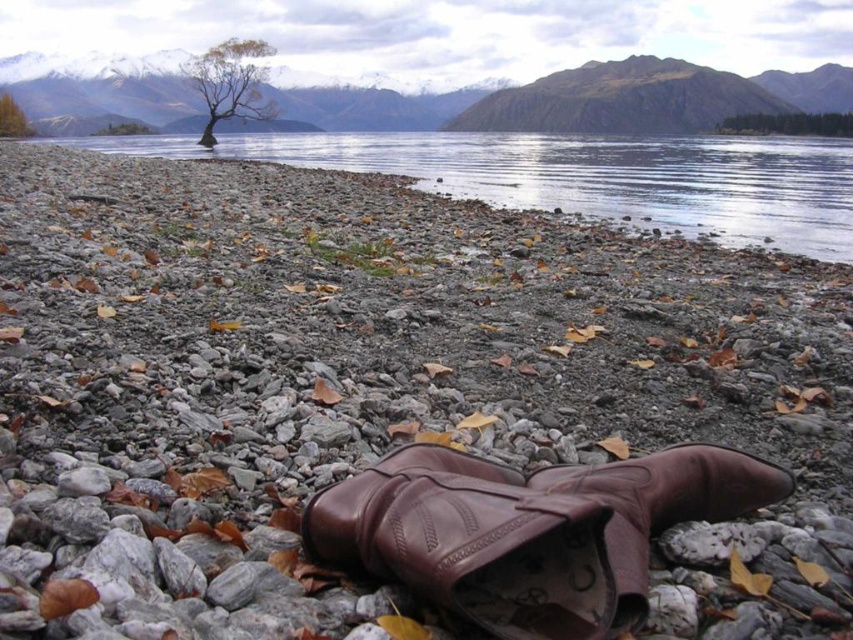
You are standing at the shore and want to step into the clear water at shore center. Based on the coordinates provided, where exactly should you step to avoid the pebbles and autumn leaves?

You should step at point [585,176] where the clear water at shore center is located to avoid the pebbles and autumn leaves.

You are planning to walk from the clear water at shore center to the green leafy tree at center. If your average walking speed is 3 feet per second, how many seconds will it take you to reach the tree?

The distance between clear water at shore center and green leafy tree at center is 91.48 feet. At a speed of 3 feet per second, dividing 91.48 by 3 gives approximately 30.5 seconds. Therefore, it will take roughly 30.5 seconds to reach the tree.

You are standing at the lakeside and want to take a photo of the brown leafy tree at upper center without the clear water at shore center in the foreground. Is this possible?

The clear water at shore center is in front of the brown leafy tree at upper center, so it will block the view. To avoid the water in the foreground, you would need to position yourself so that the tree is framed behind the water or find an angle where the water is not between you and the tree.